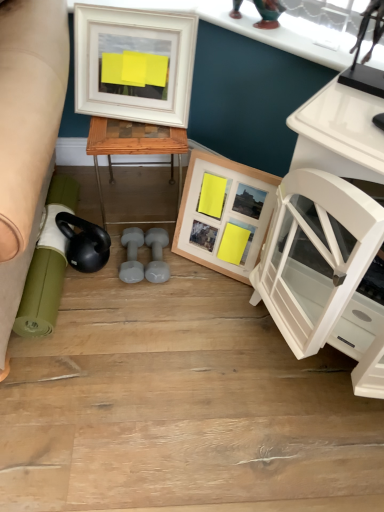
I want to click on empty space that is ontop of green rubber mat at lower left (from a real-world perspective), so click(48, 254).